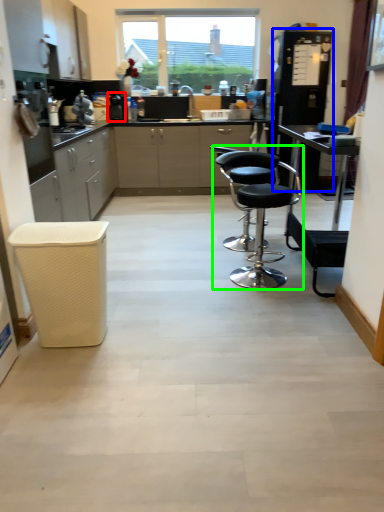
Question: Which is farther away from appliance (highlighted by a red box)? appliance (highlighted by a blue box) or chair (highlighted by a green box)?

Choices:
 (A) appliance
 (B) chair

Answer: (B)